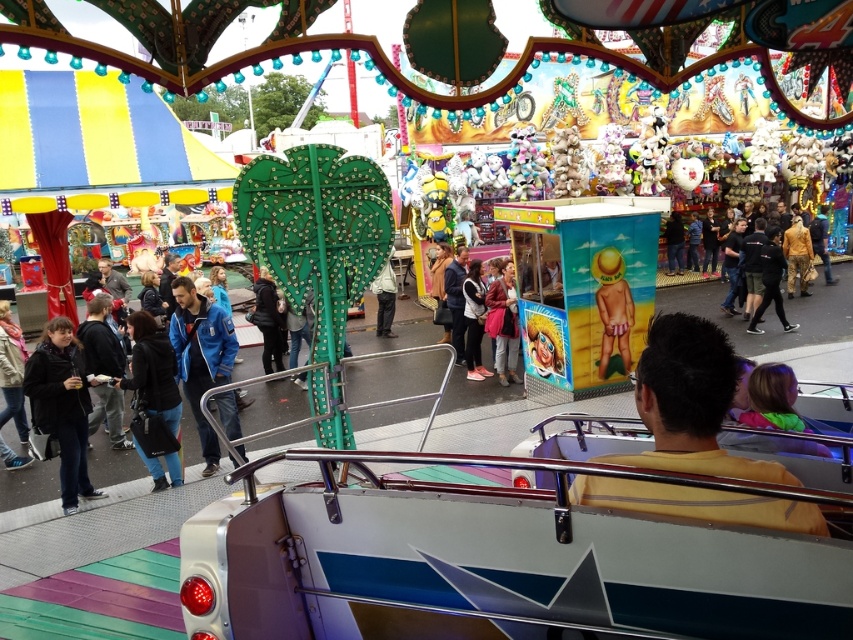
You are a vendor at the fairground. You have two jackets displayed for sale. The black matte jacket at lower left and the blue fabric jacket at center. A customer asks which jacket is narrower. Which one should you point to?

The black matte jacket at lower left is narrower than the blue fabric jacket at center.

You are standing at the center of the fairground and see the black matte jacket at lower left. Can you tell me the exact coordinates of the jacket?

The black matte jacket at lower left is located at point (62, 404).

You are standing at point (231, 397) and want to walk to the fairground exit, which is behind point (761, 500). Can you see the exit from your current position?

Point (761, 500) is in front of point (231, 397), so the exit behind point (761, 500) would not be visible from your current position at point (231, 397).